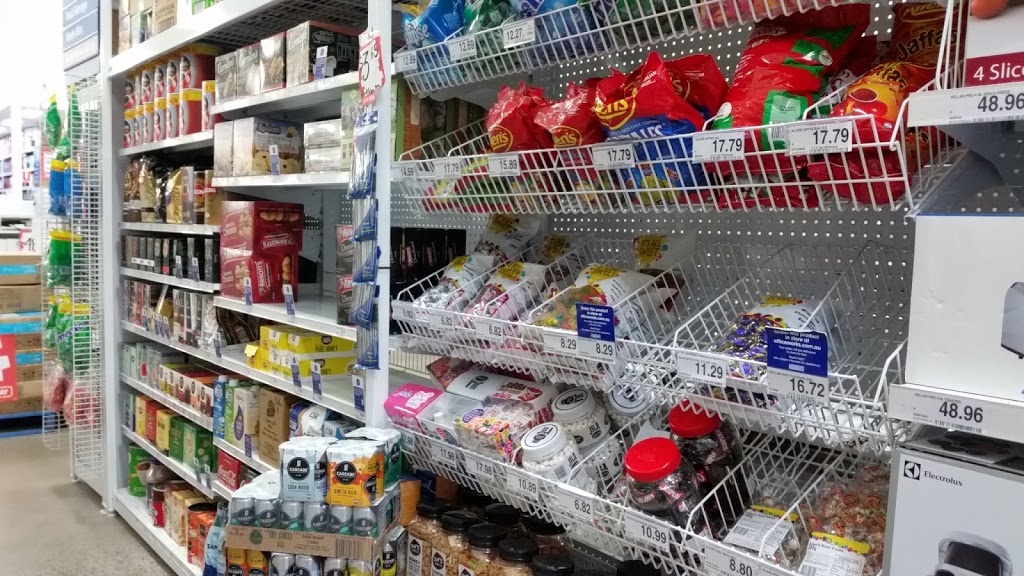
The height and width of the screenshot is (576, 1024). In order to click on floor in this screenshot , I will do `click(52, 541)`.